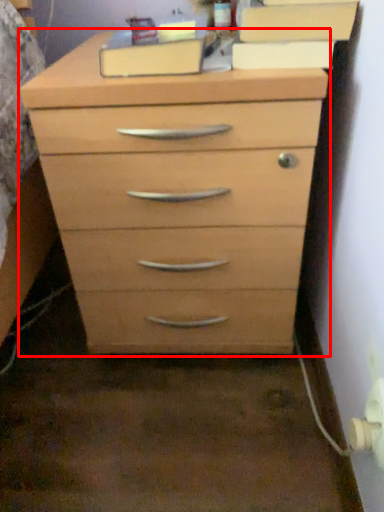
Question: From the image's perspective, where is chest of drawers (annotated by the red box) located in relation to cabinetry in the image?

Choices:
 (A) above
 (B) below

Answer: (B)